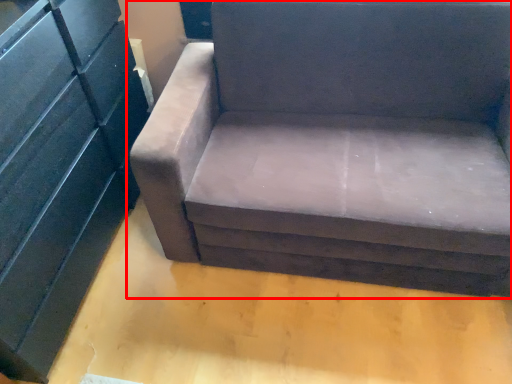
Question: Considering the relative positions of studio couch (annotated by the red box) and dresser in the image provided, where is studio couch (annotated by the red box) located with respect to the staircase?

Choices:
 (A) right
 (B) left

Answer: (A)